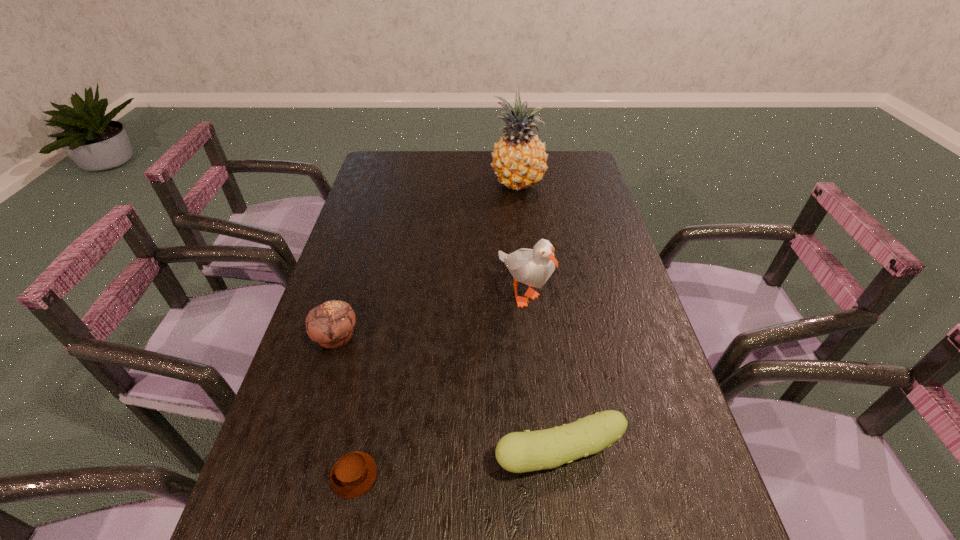
This screenshot has width=960, height=540. In order to click on free spot located on the back of the farther muffin in this screenshot , I will do `click(353, 279)`.

Where is `free region located on the left of the cucumber`? The image size is (960, 540). free region located on the left of the cucumber is located at coordinates (397, 455).

This screenshot has width=960, height=540. I want to click on blank space located on the left of the nearer muffin, so click(x=304, y=475).

The width and height of the screenshot is (960, 540). I want to click on object that is positioned at the far edge, so click(x=519, y=160).

This screenshot has width=960, height=540. Find the location of `object present at the right edge`. object present at the right edge is located at coordinates (518, 452).

The height and width of the screenshot is (540, 960). What are the coordinates of `free spot at the far edge of the desktop` in the screenshot? It's located at (470, 165).

This screenshot has height=540, width=960. What are the coordinates of `free spot at the left edge of the desktop` in the screenshot? It's located at (290, 464).

Locate an element on the screen. free space at the right edge of the desktop is located at coordinates tap(599, 240).

Locate an element on the screen. The width and height of the screenshot is (960, 540). free space at the far left corner of the desktop is located at coordinates (381, 152).

Identify the location of vacant region between the cucumber and the taller muffin. (447, 396).